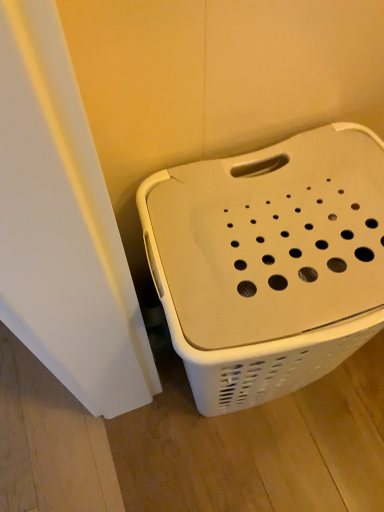
I want to click on blank space situated above white plastic laundry basket at lower right (from a real-world perspective), so click(x=297, y=289).